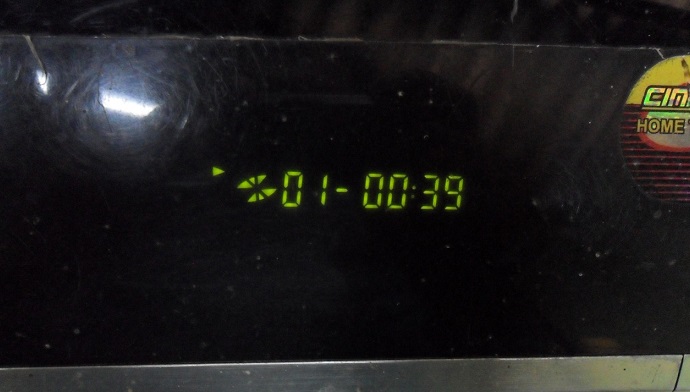
Locate an element on the screen. Image resolution: width=690 pixels, height=392 pixels. digital display is located at coordinates (221, 170), (256, 194), (285, 192), (321, 188), (346, 191), (368, 189), (390, 187), (414, 192), (431, 194), (457, 194).